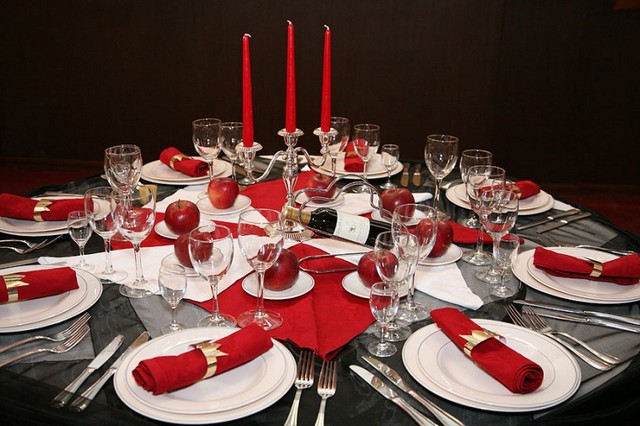
Locate an element on the screen. The width and height of the screenshot is (640, 426). apples on white plates is located at coordinates (187, 214), (182, 248), (219, 195), (282, 265), (370, 263), (445, 232), (406, 202), (312, 183).